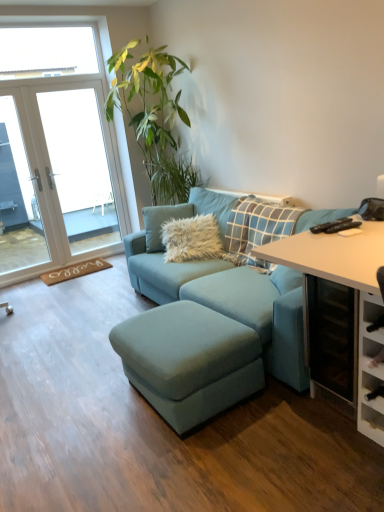
You are a GUI agent. You are given a task and a screenshot of the screen. Output one action in this format:
    pyautogui.click(x=<x>, y=<y>)
    Task: Click on the vacant space situated on the left part of suede blue footrest at center
    
    Given the screenshot: What is the action you would take?
    pyautogui.click(x=86, y=409)